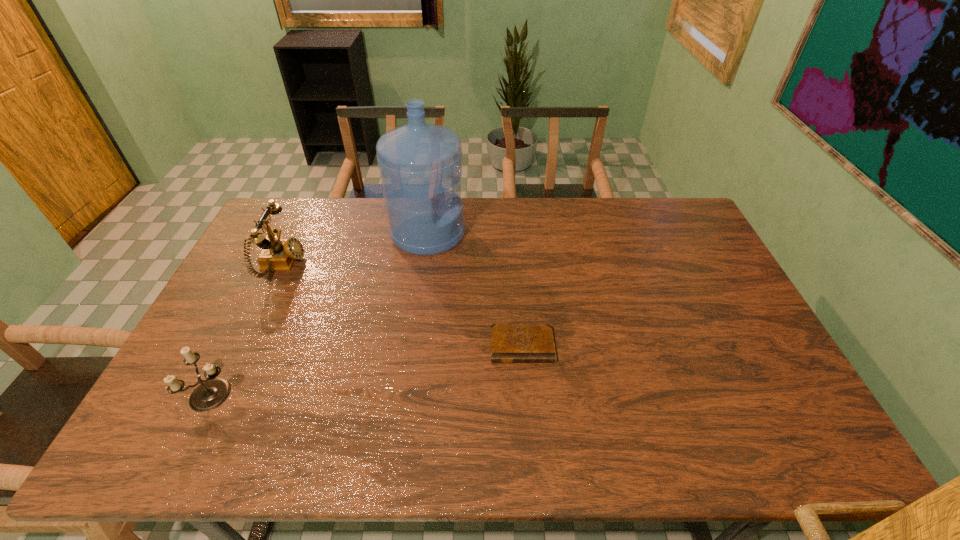
I want to click on blank space located on the spine side of the diary, so (529, 427).

Find the location of a particular element. object located at the far edge is located at coordinates (419, 162).

You are a GUI agent. You are given a task and a screenshot of the screen. Output one action in this format:
    pyautogui.click(x=<x>, y=<y>)
    Task: Click on the telephone at the left edge
    This screenshot has height=540, width=960.
    Given the screenshot: What is the action you would take?
    pyautogui.click(x=278, y=254)

Where is `candle holder present at the left edge`? The width and height of the screenshot is (960, 540). candle holder present at the left edge is located at coordinates (211, 393).

Locate an element on the screen. vacant space at the far edge is located at coordinates (361, 212).

Locate an element on the screen. free spot at the near edge of the desktop is located at coordinates (677, 444).

Identify the location of vacant space at the left edge of the desktop. This screenshot has width=960, height=540. (244, 292).

Where is `vacant area at the right edge of the desktop`? The height and width of the screenshot is (540, 960). vacant area at the right edge of the desktop is located at coordinates (676, 252).

The height and width of the screenshot is (540, 960). In the image, there is a desktop. Find the location of `vacant space at the far left corner`. vacant space at the far left corner is located at coordinates (278, 229).

At what (x,y) coordinates should I click in order to perform the action: click on vacant region at the far right corner of the desktop. Please return your answer as a coordinate pair (x, y). Looking at the image, I should click on (670, 223).